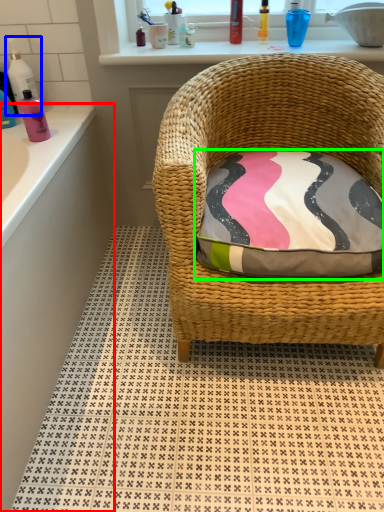
Question: Which is nearer to the bath (highlighted by a red box)? cleaning product (highlighted by a blue box) or pillow (highlighted by a green box).

Choices:
 (A) cleaning product
 (B) pillow

Answer: (A)